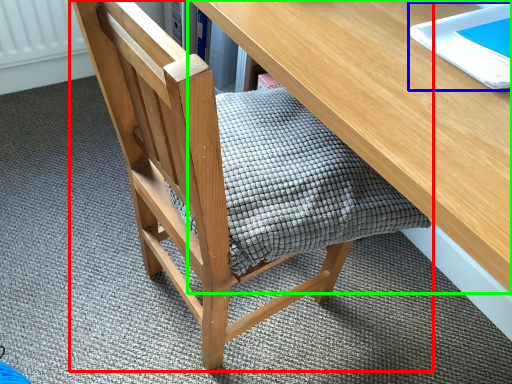
Question: Considering the real-world distances, which object is closest to chair (highlighted by a red box)? notebook (highlighted by a blue box) or desk (highlighted by a green box).

Choices:
 (A) notebook
 (B) desk

Answer: (B)